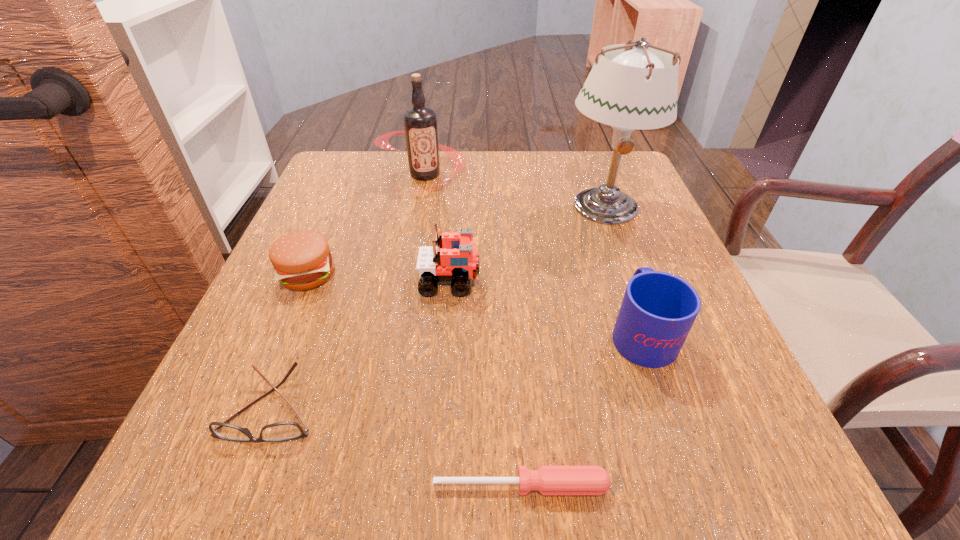
In the image, there is a desktop. Where is `vacant space at the near edge`? vacant space at the near edge is located at coordinates (495, 454).

Identify the location of free location at the left edge. (352, 226).

The image size is (960, 540). In order to click on free space at the right edge of the desktop in this screenshot , I will do `click(645, 207)`.

The width and height of the screenshot is (960, 540). In order to click on vacant space at the far left corner in this screenshot , I will do `click(338, 194)`.

Find the location of `vacant space at the far right corner`. vacant space at the far right corner is located at coordinates (578, 151).

Image resolution: width=960 pixels, height=540 pixels. What are the coordinates of `vacant space that's between the second nearest object and the screwdriver` in the screenshot? It's located at (396, 446).

You are a GUI agent. You are given a task and a screenshot of the screen. Output one action in this format:
    pyautogui.click(x=<x>, y=<y>)
    Task: Click on the free space between the tallest object and the Lego
    This screenshot has width=960, height=540.
    Given the screenshot: What is the action you would take?
    pyautogui.click(x=527, y=244)

This screenshot has height=540, width=960. I want to click on free spot between the mug and the second nearest object, so pos(457,369).

The height and width of the screenshot is (540, 960). In order to click on vacant area that lies between the shortest object and the mug in this screenshot , I will do `click(581, 409)`.

Locate an element on the screen. The image size is (960, 540). free area in between the lampshade and the third nearest object is located at coordinates click(x=623, y=269).